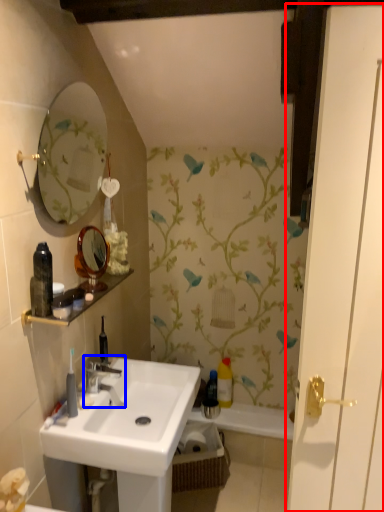
Question: Which object is closer to the camera taking this photo, door (highlighted by a red box) or tap (highlighted by a blue box)?

Choices:
 (A) door
 (B) tap

Answer: (A)